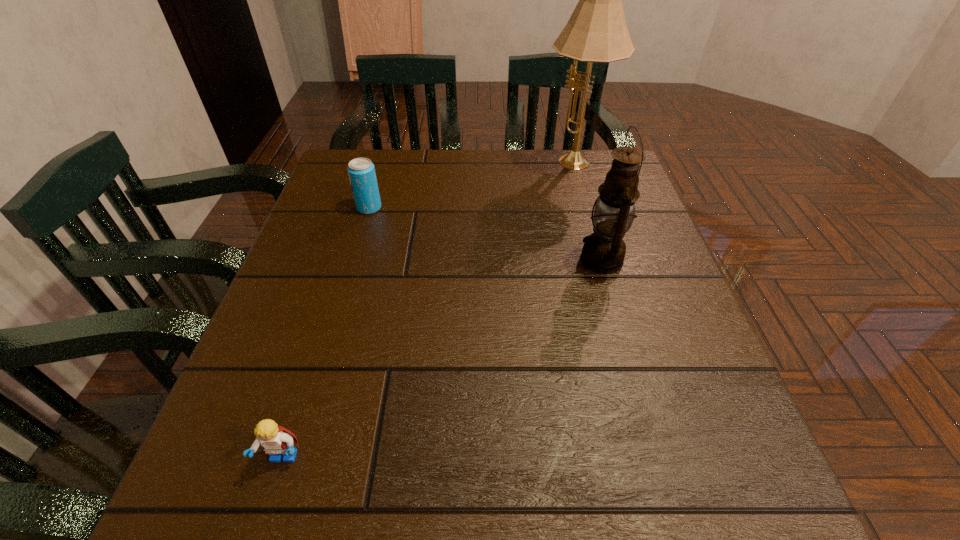
The width and height of the screenshot is (960, 540). I want to click on vacant space at the far edge, so click(x=485, y=148).

Identify the location of free region at the near edge of the desktop. The image size is (960, 540). (457, 471).

The height and width of the screenshot is (540, 960). Identify the location of free space at the left edge of the desktop. (322, 257).

You are a GUI agent. You are given a task and a screenshot of the screen. Output one action in this format:
    pyautogui.click(x=<x>, y=<y>)
    Task: Click on the free space at the right edge
    Image resolution: width=960 pixels, height=540 pixels.
    Given the screenshot: What is the action you would take?
    [647, 285]

Image resolution: width=960 pixels, height=540 pixels. In the image, there is a desktop. In order to click on free space at the far left corner in this screenshot , I will do `click(366, 152)`.

In order to click on free space at the near right corner of the desktop in this screenshot , I will do `click(712, 504)`.

Locate an element on the screen. The image size is (960, 540). blank region between the farthest object and the nearest object is located at coordinates (428, 312).

The height and width of the screenshot is (540, 960). I want to click on free space between the oil lamp and the second shortest object, so click(485, 234).

Identify the location of empty location between the shortest object and the second tallest object. This screenshot has width=960, height=540. (443, 359).

Image resolution: width=960 pixels, height=540 pixels. I want to click on free space between the tallest object and the third nearest object, so click(x=471, y=186).